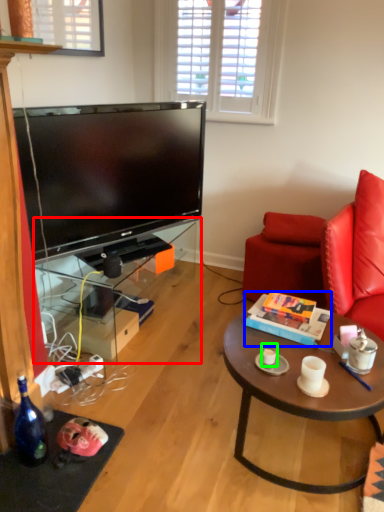
Question: Which object is positioned farthest from desk (highlighted by a red box)? Select from box (highlighted by a blue box) and coffee cup (highlighted by a green box).

Choices:
 (A) box
 (B) coffee cup

Answer: (B)